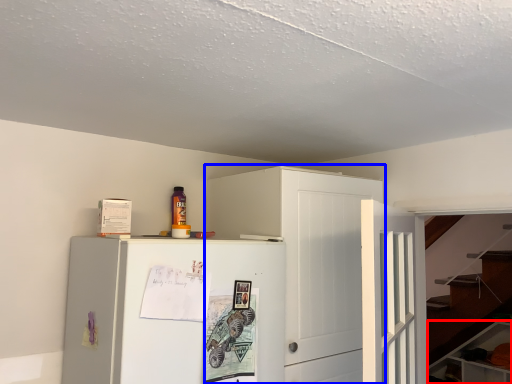
Question: Which object is further to the camera taking this photo, cabinetry (highlighted by a red box) or cabinetry (highlighted by a blue box)?

Choices:
 (A) cabinetry
 (B) cabinetry

Answer: (A)